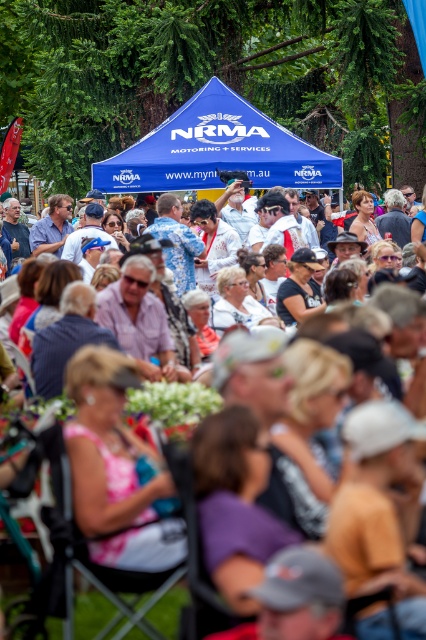
Locate an element on the screen. This screenshot has width=426, height=640. blue fabric canopy at center is located at coordinates (215, 148).

In the scene shown: Between blue fabric canopy at center and matte white shirts at center, which one has more height?

blue fabric canopy at center

Which is behind, point (106, 168) or point (181, 385)?

Point (106, 168)

The image size is (426, 640). I want to click on blue fabric canopy at center, so click(215, 148).